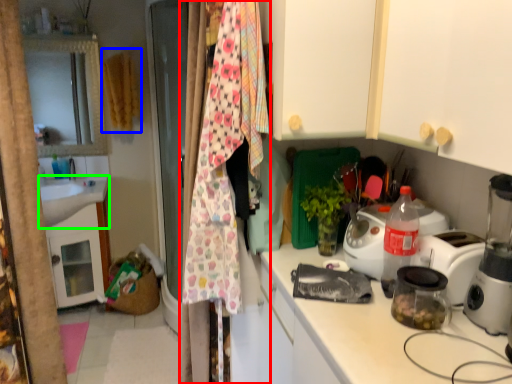
Question: Which object is the farthest from clothesline (highlighted by a red box)? Choose among these: clothesline (highlighted by a blue box) or sink (highlighted by a green box).

Choices:
 (A) clothesline
 (B) sink

Answer: (B)